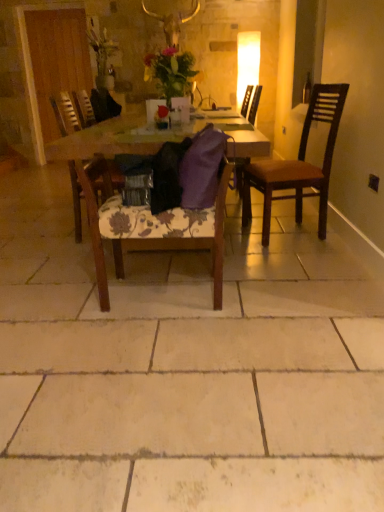
Locate an element on the screen. The width and height of the screenshot is (384, 512). blank area beneath dark brown wood chair at right, which appears as the first chair when viewed from the right (from a real-world perspective) is located at coordinates pos(289,232).